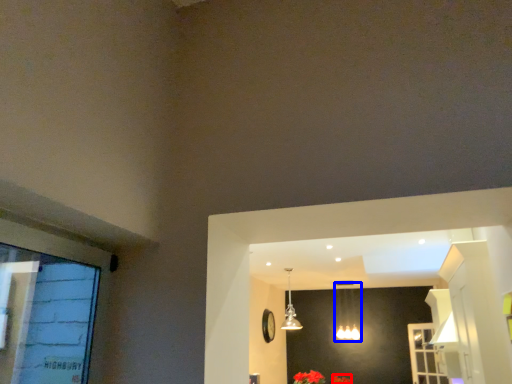
Question: Which object is closer to the camera taking this photo, flower (highlighted by a red box) or lamp (highlighted by a blue box)?

Choices:
 (A) flower
 (B) lamp

Answer: (A)